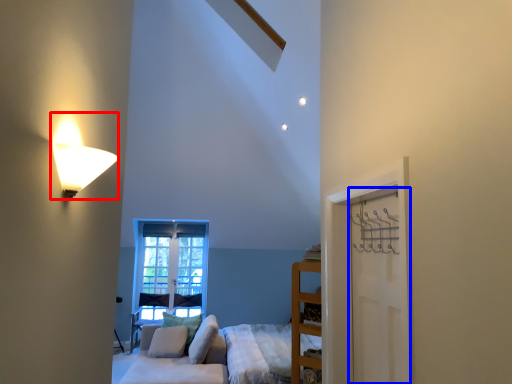
Question: Which of the following is the farthest to the observer, lamp (highlighted by a red box) or door (highlighted by a blue box)?

Choices:
 (A) lamp
 (B) door

Answer: (B)